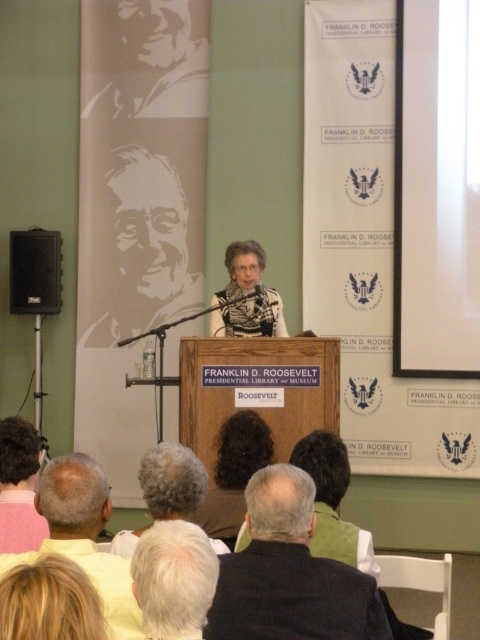
You are seated in the audience at the Franklin D. Roosevelt Presidential Library and Museum event. You notice two points marked in the room. The first point is at coordinate point [175,480], and the second is at point [23,282]. If you want to move closer to the speaker who is behind the podium, which point should you walk towards?

You should walk towards point [175,480] because it is in front of point [23,282], meaning it is closer to the speaker at the podium.

You are a photographer at the event and want to take a photo of the gray hair at center and the black plastic speaker at left. Which object should you focus on first if you want to capture both in a single shot without moving the camera?

The gray hair at center should be focused on first because it is closer to the camera than the black plastic speaker at left, so adjusting focus to the gray hair at center will ensure both are in the frame.

Consider the image. You are an attendee at the event and want to see both the gray matte portrait at upper left and the silhouette paper portrait at upper left. Which one is positioned lower on the wall?

The gray matte portrait at upper left is positioned lower on the wall because it is below the silhouette paper portrait at upper left.